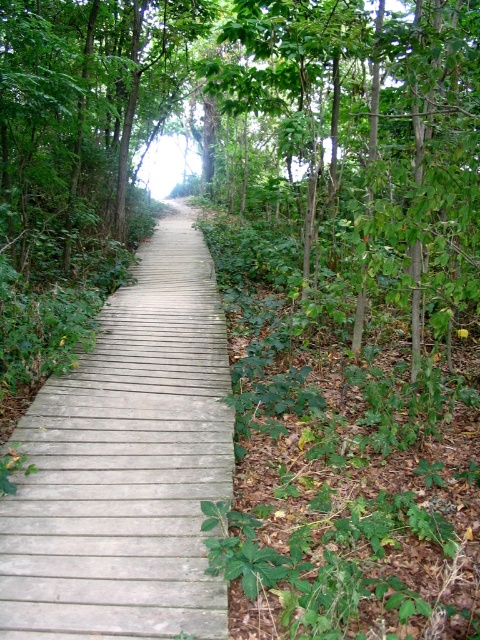
You are a hiker walking along the wooden boardwalk in the forest. You notice the wooden planks at center and the green leafy tree at center. Which object is closer to the ground?

The wooden planks at center are located below the green leafy tree at center, so the wooden planks at center are closer to the ground.

You are a hiker walking along the wooden boardwalk in the forest. You notice two points marked on the boardwalk at coordinates point (196, 540) and point (391, 262). Which point is closer to your current position if you are facing the direction the boardwalk extends into the distance?

Point (196, 540) is in front of point (391, 262), so if you are facing the direction the boardwalk extends, point (196, 540) is closer to your current position.